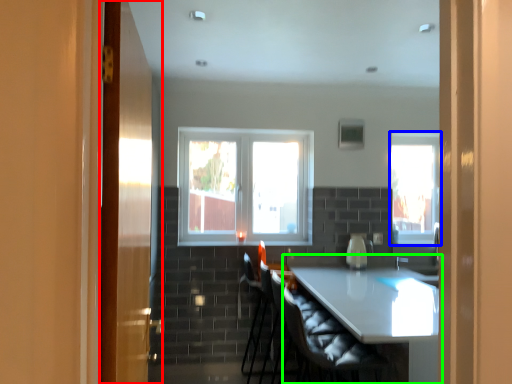
Question: Which object is the closest to the door (highlighted by a red box)? Choose among these: window (highlighted by a blue box) or table (highlighted by a green box).

Choices:
 (A) window
 (B) table

Answer: (B)